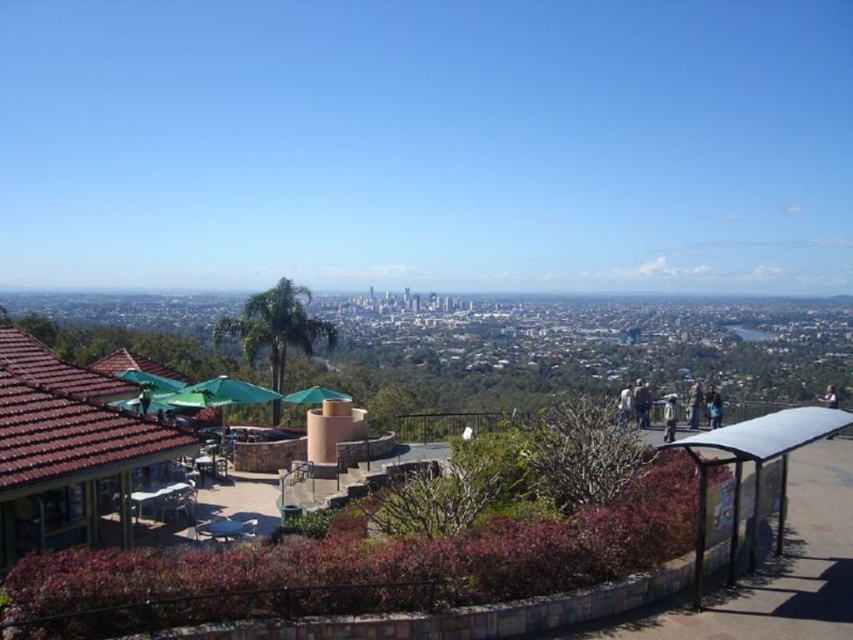
Question: Can you confirm if metallic silver bus stop at lower right is positioned to the left of white fabric umbrella at upper center?

Choices:
 (A) yes
 (B) no

Answer: (A)

Question: Is metallic silver bus stop at lower right behind white fabric person at center-right?

Choices:
 (A) no
 (B) yes

Answer: (A)

Question: Which of these objects is positioned farthest from the white fabric person at center-right?

Choices:
 (A) white fabric umbrella at upper center
 (B) dark blue shirt at center right
 (C) metallic silver bus stop at lower right
 (D) dark blue fabric at lower right

Answer: (B)

Question: Which of the following is the closest to the observer?

Choices:
 (A) dark blue fabric at lower right
 (B) white fabric person at center-right

Answer: (B)

Question: Among these objects, which one is nearest to the camera?

Choices:
 (A) white fabric person at center-right
 (B) white fabric umbrella at upper center

Answer: (B)

Question: Is white fabric person at center-right positioned behind white fabric umbrella at upper center?

Choices:
 (A) no
 (B) yes

Answer: (B)